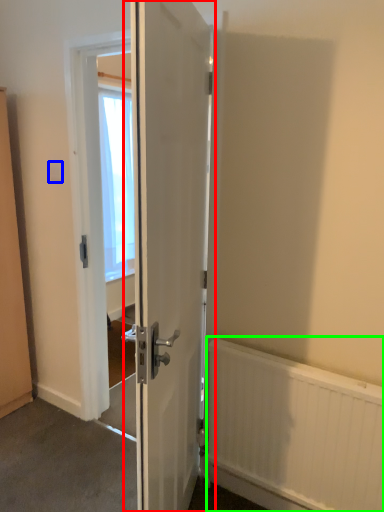
Question: Which object is the farthest from door (highlighted by a red box)? Choose among these: electric outlet (highlighted by a blue box) or radiator (highlighted by a green box).

Choices:
 (A) electric outlet
 (B) radiator

Answer: (A)